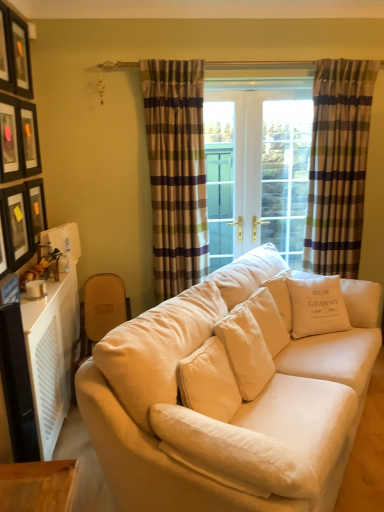
This screenshot has height=512, width=384. Identify the location of matte black picture frame at upper left, which is the 2th picture frame from top to bottom. (5, 52).

Measure the distance between point (192, 416) and camera.

A distance of 1.58 meters exists between point (192, 416) and camera.

The height and width of the screenshot is (512, 384). In order to click on matte black picture frame at upper left, acting as the 3th picture frame starting from the bottom in this screenshot , I will do [x=9, y=140].

Describe the element at coordinates (232, 454) in the screenshot. This screenshot has width=384, height=512. I see `white soft cushion at center, acting as the 1th pillow starting from the left` at that location.

This screenshot has width=384, height=512. I want to click on matte black picture frame at upper left, which is the 2th picture frame from top to bottom, so click(x=5, y=52).

Is white cotton cushion at center, which is counted as the second pillow, starting from the left, wider than matte black picture frame at upper left, which appears as the fifth picture frame when viewed from the top?

Yes, white cotton cushion at center, which is counted as the second pillow, starting from the left, is wider than matte black picture frame at upper left, which appears as the fifth picture frame when viewed from the top.

Considering the relative positions of white cotton cushion at center, which is the first pillow in top-to-bottom order, and matte black picture frame at upper left, which appears as the fifth picture frame when viewed from the top, in the image provided, is white cotton cushion at center, which is the first pillow in top-to-bottom order, to the left of matte black picture frame at upper left, which appears as the fifth picture frame when viewed from the top, from the viewer's perspective?

No.

From the image's perspective, starting from the matte black picture frame at upper left, which appears as the fifth picture frame when viewed from the top, which pillow is the 1st one below? Please provide its 2D coordinates.

[(317, 306)]

Is white cotton cushion at center, which is the first pillow in top-to-bottom order, beside matte black picture frame at upper left, which appears as the fifth picture frame when viewed from the top?

No, white cotton cushion at center, which is the first pillow in top-to-bottom order, is not touching matte black picture frame at upper left, which appears as the fifth picture frame when viewed from the top.

Is plaid fabric curtain at center, which is the second curtain from right to left, next to matte black picture frame at upper left, the second picture frame positioned from the bottom?

No.

From the picture: Can you confirm if plaid fabric curtain at center, which is the second curtain from right to left, is thinner than matte black picture frame at upper left, the second picture frame positioned from the bottom?

No, plaid fabric curtain at center, which is the second curtain from right to left, is not thinner than matte black picture frame at upper left, the second picture frame positioned from the bottom.

Consider the image. Considering the relative positions of plaid fabric curtain at center, which ranks as the 1th curtain in left-to-right order, and matte black picture frame at upper left, the second picture frame positioned from the bottom, in the image provided, is plaid fabric curtain at center, which ranks as the 1th curtain in left-to-right order, to the right of matte black picture frame at upper left, the second picture frame positioned from the bottom, from the viewer's perspective?

Yes, plaid fabric curtain at center, which ranks as the 1th curtain in left-to-right order, is to the right of matte black picture frame at upper left, the second picture frame positioned from the bottom.

From the image's perspective, is plaid fabric curtain at center, which ranks as the 1th curtain in left-to-right order, positioned above or below matte black picture frame at upper left, the second picture frame positioned from the bottom?

Clearly, from the image's perspective, plaid fabric curtain at center, which ranks as the 1th curtain in left-to-right order, is above matte black picture frame at upper left, the second picture frame positioned from the bottom.

Considering the relative sizes of matte black picture frame at upper left, the 4th picture frame when ordered from top to bottom, and plaid fabric curtain at right, the second curtain in the left-to-right sequence, in the image provided, is matte black picture frame at upper left, the 4th picture frame when ordered from top to bottom, shorter than plaid fabric curtain at right, the second curtain in the left-to-right sequence,?

Yes.

From a real-world perspective, is matte black picture frame at upper left, acting as the 3th picture frame starting from the bottom, beneath plaid fabric curtain at right, which is the first curtain from right to left?

Incorrect, from a real-world perspective, matte black picture frame at upper left, acting as the 3th picture frame starting from the bottom, is higher than plaid fabric curtain at right, which is the first curtain from right to left.

Is matte black picture frame at upper left, acting as the 3th picture frame starting from the bottom, bigger or smaller than plaid fabric curtain at right, which is the first curtain from right to left?

Clearly, matte black picture frame at upper left, acting as the 3th picture frame starting from the bottom, is smaller in size than plaid fabric curtain at right, which is the first curtain from right to left.

Is matte black picture frame at upper left, acting as the 3th picture frame starting from the bottom, oriented away from plaid fabric curtain at right, which is the first curtain from right to left?

matte black picture frame at upper left, acting as the 3th picture frame starting from the bottom, does not have its back to plaid fabric curtain at right, which is the first curtain from right to left.

From a real-world perspective, is matte black picture frame at upper left, placed as the 3th picture frame when sorted from top to bottom, located beneath plaid fabric curtain at right, which is the first curtain from right to left?

Incorrect, from a real-world perspective, matte black picture frame at upper left, placed as the 3th picture frame when sorted from top to bottom, is higher than plaid fabric curtain at right, which is the first curtain from right to left.

How distant is matte black picture frame at upper left, placed as the 3th picture frame when sorted from top to bottom, from plaid fabric curtain at right, which is the first curtain from right to left?

matte black picture frame at upper left, placed as the 3th picture frame when sorted from top to bottom, is 2.00 meters away from plaid fabric curtain at right, which is the first curtain from right to left.

Looking at this image, does matte black picture frame at upper left, placed as the 3th picture frame when sorted from top to bottom, have a smaller size compared to plaid fabric curtain at right, the second curtain in the left-to-right sequence?

Yes, matte black picture frame at upper left, placed as the 3th picture frame when sorted from top to bottom, is smaller than plaid fabric curtain at right, the second curtain in the left-to-right sequence.

Is the surface of matte black picture frame at upper left, marked as the fourth picture frame in a bottom-to-top arrangement, in direct contact with plaid fabric curtain at right, which is the first curtain from right to left?

No, matte black picture frame at upper left, marked as the fourth picture frame in a bottom-to-top arrangement, is not touching plaid fabric curtain at right, which is the first curtain from right to left.

Is point (323, 324) closer to camera compared to point (343, 209)?

Yes, it is in front of point (343, 209).

Between white cotton cushion at center, the second pillow in the bottom-to-top sequence, and plaid fabric curtain at right, which is the first curtain from right to left, which one is positioned behind?

plaid fabric curtain at right, which is the first curtain from right to left.

The width and height of the screenshot is (384, 512). In order to click on pillow that is the 1st one when counting forward from the plaid fabric curtain at right, the second curtain in the left-to-right sequence in this screenshot , I will do `click(317, 306)`.

From the image's perspective, would you say white cotton cushion at center, which is counted as the second pillow, starting from the front, is positioned over plaid fabric curtain at right, which is the first curtain from right to left?

No, from the image's perspective, white cotton cushion at center, which is counted as the second pillow, starting from the front, is not above plaid fabric curtain at right, which is the first curtain from right to left.

From a real-world perspective, who is located lower, matte black picture frame at upper left, arranged as the 6th picture frame when ordered from the bottom, or white soft cushion at center, which is counted as the second pillow, starting from the back?

white soft cushion at center, which is counted as the second pillow, starting from the back, is physically lower.

The image size is (384, 512). In order to click on picture frame that is the 6th one when counting upward from the white soft cushion at center, which is counted as the second pillow, starting from the back (from the image's perspective) in this screenshot , I will do `click(20, 55)`.

Between matte black picture frame at upper left, arranged as the 6th picture frame when ordered from the bottom, and white soft cushion at center, which appears as the second pillow when viewed from the top, which one has smaller width?

Result: With smaller width is matte black picture frame at upper left, arranged as the 6th picture frame when ordered from the bottom.

Can you tell me how much matte black picture frame at upper left, which is the 2th picture frame from top to bottom, and matte black picture frame at upper left, which is the sixth picture frame in top-to-bottom order, differ in facing direction?

The angle between the facing direction of matte black picture frame at upper left, which is the 2th picture frame from top to bottom, and the facing direction of matte black picture frame at upper left, which is the sixth picture frame in top-to-bottom order, is 0.0172 degrees.

From a real-world perspective, is matte black picture frame at upper left, which is the 2th picture frame from top to bottom, positioned above or below matte black picture frame at upper left, the 1th picture frame positioned from the bottom?

matte black picture frame at upper left, which is the 2th picture frame from top to bottom, is above matte black picture frame at upper left, the 1th picture frame positioned from the bottom.

Is matte black picture frame at upper left, arranged as the fifth picture frame when ordered from the bottom, in contact with matte black picture frame at upper left, the 1th picture frame positioned from the bottom?

No, matte black picture frame at upper left, arranged as the fifth picture frame when ordered from the bottom, is not with matte black picture frame at upper left, the 1th picture frame positioned from the bottom.

Could you measure the distance between matte black picture frame at upper left, which is the 2th picture frame from top to bottom, and matte black picture frame at upper left, which is the sixth picture frame in top-to-bottom order?

matte black picture frame at upper left, which is the 2th picture frame from top to bottom, is 27.79 inches from matte black picture frame at upper left, which is the sixth picture frame in top-to-bottom order.

Where is `picture frame located behind the white cotton cushion at center, which is counted as the second pillow, starting from the front`? Image resolution: width=384 pixels, height=512 pixels. picture frame located behind the white cotton cushion at center, which is counted as the second pillow, starting from the front is located at coordinates (36, 209).

You are a GUI agent. You are given a task and a screenshot of the screen. Output one action in this format:
    pyautogui.click(x=<x>, y=<y>)
    Task: Click on the 4th picture frame counting from the left side of the plaid fabric curtain at center, which ranks as the 1th curtain in left-to-right order
    This screenshot has width=384, height=512.
    Given the screenshot: What is the action you would take?
    pyautogui.click(x=36, y=209)

Based on their spatial positions, is plaid fabric curtain at right, which is the first curtain from right to left, or matte black picture frame at upper left, the 1th picture frame when ordered from top to bottom, closer to matte black picture frame at upper left, the 1th picture frame positioned from the bottom?

matte black picture frame at upper left, the 1th picture frame when ordered from top to bottom.

When comparing their distances from plaid fabric curtain at center, which is the second curtain from right to left, does matte black picture frame at upper left, acting as the 3th picture frame starting from the bottom, or white plastic radiator at lower left seem closer?

Based on the image, matte black picture frame at upper left, acting as the 3th picture frame starting from the bottom, appears to be nearer to plaid fabric curtain at center, which is the second curtain from right to left.

Based on their spatial positions, is matte black picture frame at upper left, acting as the 3th picture frame starting from the bottom, or matte black picture frame at upper left, marked as the fourth picture frame in a bottom-to-top arrangement, further from beige fabric couch at center?

matte black picture frame at upper left, marked as the fourth picture frame in a bottom-to-top arrangement, is positioned further to the anchor beige fabric couch at center.

Based on their spatial positions, is matte black picture frame at upper left, arranged as the 6th picture frame when ordered from the bottom, or white soft cushion at center, which appears as the second pillow when viewed from the top, further from matte black picture frame at upper left, placed as the 3th picture frame when sorted from top to bottom?

white soft cushion at center, which appears as the second pillow when viewed from the top, is further to matte black picture frame at upper left, placed as the 3th picture frame when sorted from top to bottom.

Estimate the real-world distances between objects in this image. Which object is closer to plaid fabric curtain at center, which is the second curtain from right to left, matte black picture frame at upper left, arranged as the fifth picture frame when ordered from the bottom, or matte black picture frame at upper left, which appears as the fifth picture frame when viewed from the top?

matte black picture frame at upper left, which appears as the fifth picture frame when viewed from the top, is positioned closer to the anchor plaid fabric curtain at center, which is the second curtain from right to left.

Considering their positions, is white soft cushion at center, the 1th pillow viewed from the front, positioned further to matte black picture frame at upper left, marked as the fourth picture frame in a bottom-to-top arrangement, than plaid fabric curtain at center, which is the second curtain from right to left?

white soft cushion at center, the 1th pillow viewed from the front, is positioned further to the anchor matte black picture frame at upper left, marked as the fourth picture frame in a bottom-to-top arrangement.

Considering their positions, is matte black picture frame at upper left, the 1th picture frame when ordered from top to bottom, positioned further to plaid fabric curtain at right, which is the first curtain from right to left, than white soft cushion at center, which appears as the second pillow when viewed from the top?

Among the two, white soft cushion at center, which appears as the second pillow when viewed from the top, is located further to plaid fabric curtain at right, which is the first curtain from right to left.

Looking at the image, which one is located closer to white plastic radiator at lower left, matte black picture frame at upper left, the second picture frame positioned from the bottom, or matte black picture frame at upper left, the 1th picture frame positioned from the bottom?

matte black picture frame at upper left, the 1th picture frame positioned from the bottom, is closer to white plastic radiator at lower left.

Where is `curtain positioned between white soft cushion at center, which is counted as the second pillow, starting from the back, and plaid fabric curtain at right, which is the first curtain from right to left, from near to far`? The width and height of the screenshot is (384, 512). curtain positioned between white soft cushion at center, which is counted as the second pillow, starting from the back, and plaid fabric curtain at right, which is the first curtain from right to left, from near to far is located at coordinates (176, 172).

Where is `dresser situated between matte black picture frame at upper left, which appears as the fifth picture frame when viewed from the top, and plaid fabric curtain at right, the second curtain in the left-to-right sequence, from left to right`? This screenshot has width=384, height=512. dresser situated between matte black picture frame at upper left, which appears as the fifth picture frame when viewed from the top, and plaid fabric curtain at right, the second curtain in the left-to-right sequence, from left to right is located at coordinates (51, 354).

Identify the location of pillow positioned between beige fabric couch at center and white cotton cushion at center, which is the first pillow in back-to-front order, from near to far. (232, 454).

Locate an element on the screen. The height and width of the screenshot is (512, 384). pillow between matte black picture frame at upper left, placed as the 3th picture frame when sorted from top to bottom, and white cotton cushion at center, which is counted as the second pillow, starting from the left, in the horizontal direction is located at coordinates (232, 454).